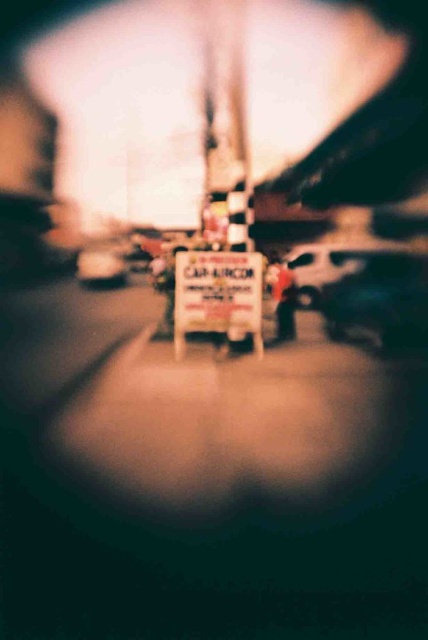
Consider the image. You are driving a car and want to park it in a parking spot that can only accommodate vehicles up to the width of the metallic silver van at center. Can your shiny black car at center fit into this parking spot?

The shiny black car at center is thinner than the metallic silver van at center, so yes, the shiny black car at center can fit into the parking spot designed for the metallic silver van at center.

You are standing in front of the CAR AIRCON signboard and notice two points marked on it. Which point is closer to you, point (x=199, y=253) or point (x=89, y=278)?

Point (x=199, y=253) is closer to the viewer than point (x=89, y=278).

You are a delivery driver who needs to park your truck behind the shiny black car at center and the metallic silver van at center. Which vehicle should you park behind first to ensure your truck can fit between them?

The shiny black car at center is much taller than the metallic silver van at center, so you should park behind the metallic silver van at center first to ensure there is enough vertical space for your truck between them.